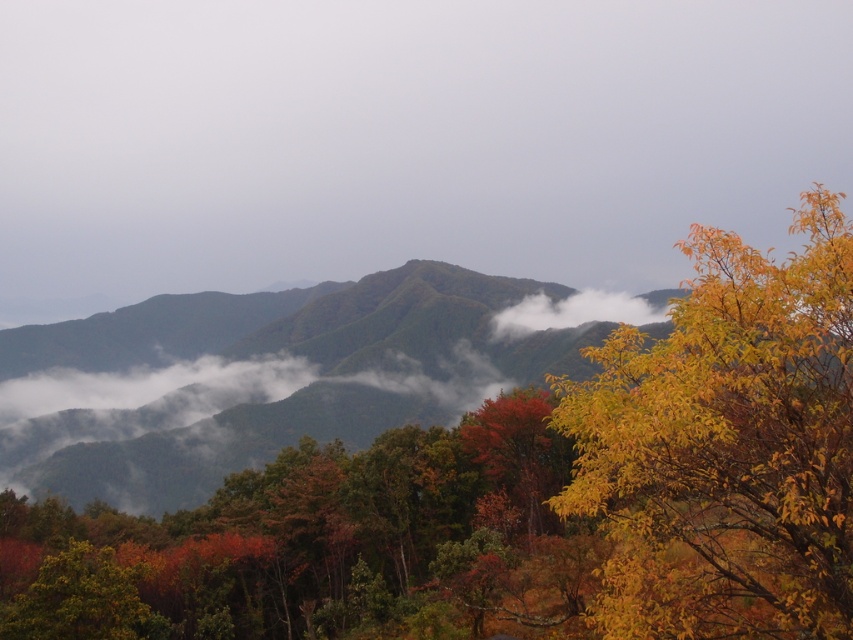
Is autumn leaves at center smaller than white fluffy cloud at center?

Correct, autumn leaves at center occupies less space than white fluffy cloud at center.

Is autumn leaves at center wider than white fluffy cloud at center?

In fact, autumn leaves at center might be narrower than white fluffy cloud at center.

Who is more distant from viewer, (169, 637) or (508, 320)?

The point (508, 320) is behind.

Where is `autumn leaves at center`? autumn leaves at center is located at coordinates (318, 541).

Is white mist at center shorter than autumn foliage at center?

In fact, white mist at center may be taller than autumn foliage at center.

Does point (474, 259) lie in front of point (718, 378)?

No, (474, 259) is behind (718, 378).

Which is in front, point (590, 90) or point (712, 390)?

Point (712, 390) is in front.

Locate an element on the screen. The image size is (853, 640). white mist at center is located at coordinates (399, 140).

Measure the distance between autumn leaves at center and yellow leafy tree at right.

233.80 feet

Looking at this image, is autumn leaves at center wider than yellow leafy tree at right?

Correct, the width of autumn leaves at center exceeds that of yellow leafy tree at right.

Between point (206, 604) and point (628, 552), which one is positioned behind?

Point (206, 604)

Find the location of a particular element. Image resolution: width=853 pixels, height=640 pixels. autumn leaves at center is located at coordinates (318, 541).